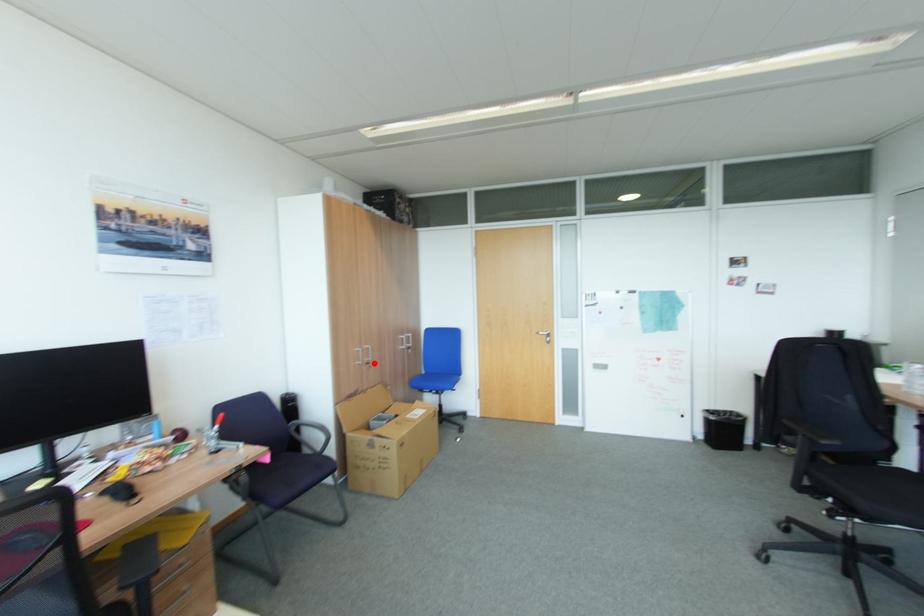
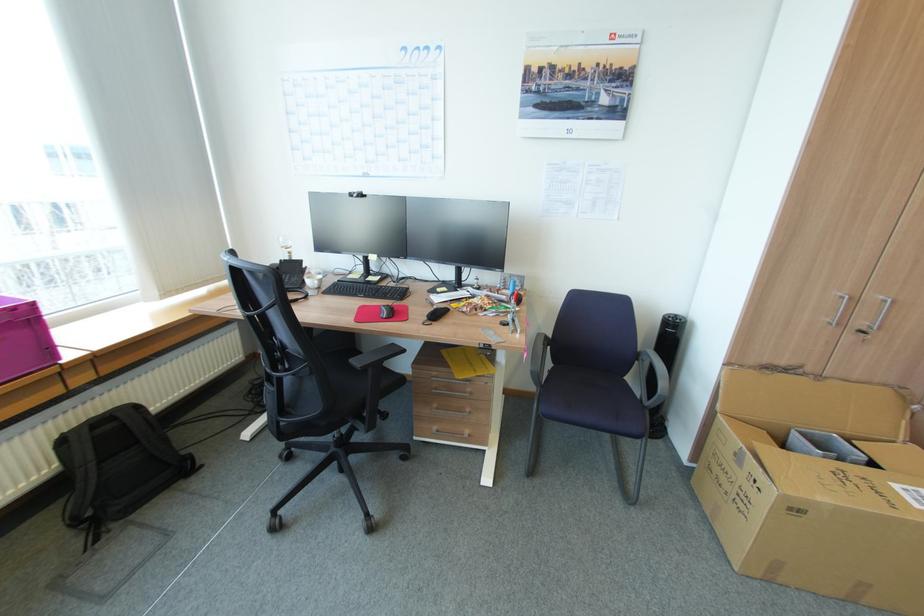
In the second image, find the point that corresponds to the highlighted location in the first image.

(868, 331)